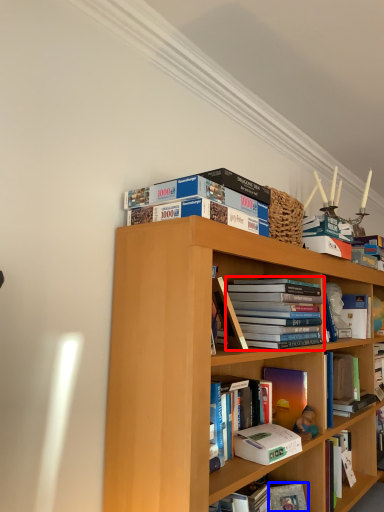
Question: Which object appears closest to the camera in this image, book (highlighted by a red box) or paperback book (highlighted by a blue box)?

Choices:
 (A) book
 (B) paperback book

Answer: (A)